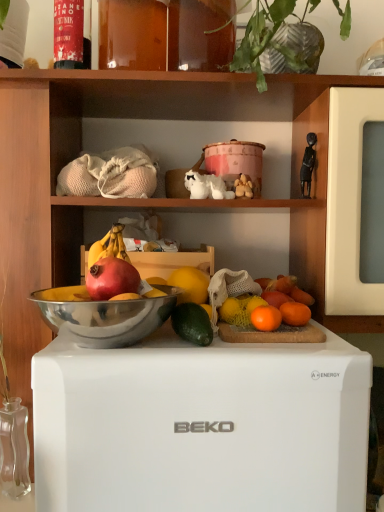
What are the coordinates of `free space to the right of red matte grapefruit at center, placed as the first grapefruit when sorted from left to right` in the screenshot? It's located at (185, 343).